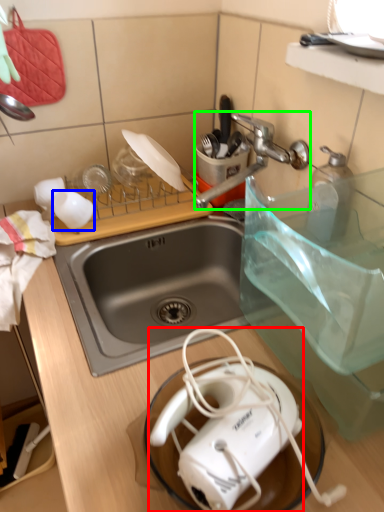
Question: Which is farther away from toaster (highlighted by a red box)? coffee cup (highlighted by a blue box) or faucet (highlighted by a green box)?

Choices:
 (A) coffee cup
 (B) faucet

Answer: (A)